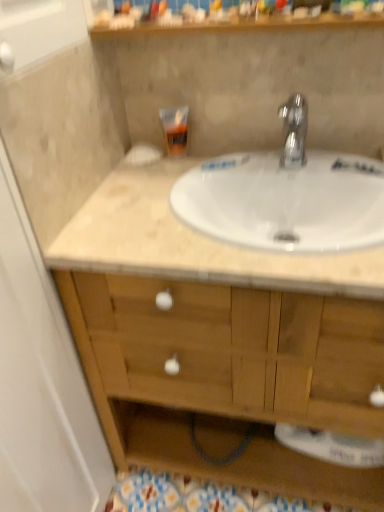
Question: From the image's perspective, is polished chrome faucet at upper center positioned above or below wooden cabinet at center?

Choices:
 (A) below
 (B) above

Answer: (B)

Question: In terms of height, does polished chrome faucet at upper center look taller or shorter compared to wooden cabinet at center?

Choices:
 (A) short
 (B) tall

Answer: (A)

Question: Which of these objects is positioned farthest from the polished chrome faucet at upper center?

Choices:
 (A) wooden cabinet at center
 (B) translucent plastic tube at upper center
 (C) wooden shelf at upper center
 (D) white marble sink at center

Answer: (A)

Question: Which of these objects is positioned closest to the wooden cabinet at center?

Choices:
 (A) white marble sink at center
 (B) translucent plastic tube at upper center
 (C) wooden shelf at upper center
 (D) polished chrome faucet at upper center

Answer: (A)